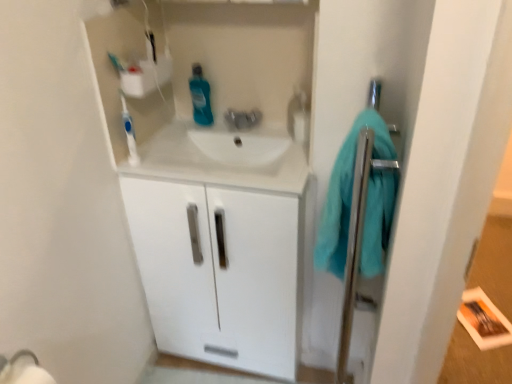
Question: Is white glossy cabinet at center bigger than blue glossy mouthwash at center?

Choices:
 (A) yes
 (B) no

Answer: (A)

Question: Is white glossy cabinet at center located outside blue glossy mouthwash at center?

Choices:
 (A) yes
 (B) no

Answer: (A)

Question: From the image's perspective, would you say white glossy cabinet at center is positioned over blue glossy mouthwash at center?

Choices:
 (A) yes
 (B) no

Answer: (B)

Question: From a real-world perspective, is white glossy cabinet at center positioned over blue glossy mouthwash at center based on gravity?

Choices:
 (A) yes
 (B) no

Answer: (B)

Question: Does white glossy cabinet at center have a lesser height compared to blue glossy mouthwash at center?

Choices:
 (A) no
 (B) yes

Answer: (A)

Question: Does white glossy cabinet at center turn towards blue glossy mouthwash at center?

Choices:
 (A) yes
 (B) no

Answer: (B)

Question: Does teal soft towel at right appear on the left side of blue glossy mouthwash at center?

Choices:
 (A) yes
 (B) no

Answer: (B)

Question: Is teal soft towel at right turned away from blue glossy mouthwash at center?

Choices:
 (A) yes
 (B) no

Answer: (B)

Question: Is teal soft towel at right bigger than blue glossy mouthwash at center?

Choices:
 (A) yes
 (B) no

Answer: (A)

Question: From a real-world perspective, does teal soft towel at right sit lower than blue glossy mouthwash at center?

Choices:
 (A) no
 (B) yes

Answer: (B)

Question: Can you confirm if teal soft towel at right is positioned to the right of blue glossy mouthwash at center?

Choices:
 (A) yes
 (B) no

Answer: (A)

Question: From the image's perspective, is teal soft towel at right located beneath blue glossy mouthwash at center?

Choices:
 (A) no
 (B) yes

Answer: (B)

Question: From the image's perspective, does blue glossy mouthwash at center appear lower than white plastic toothbrush at upper left?

Choices:
 (A) no
 (B) yes

Answer: (A)